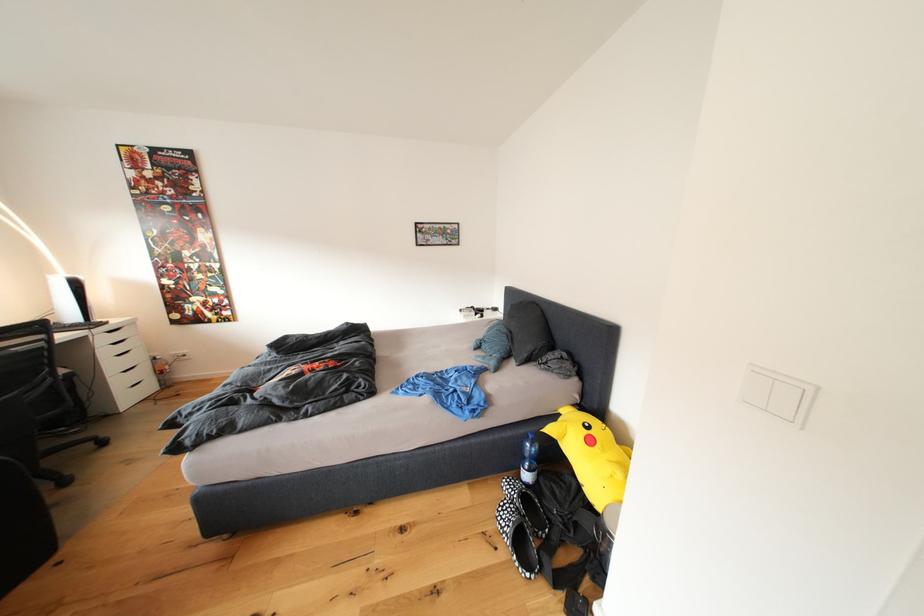
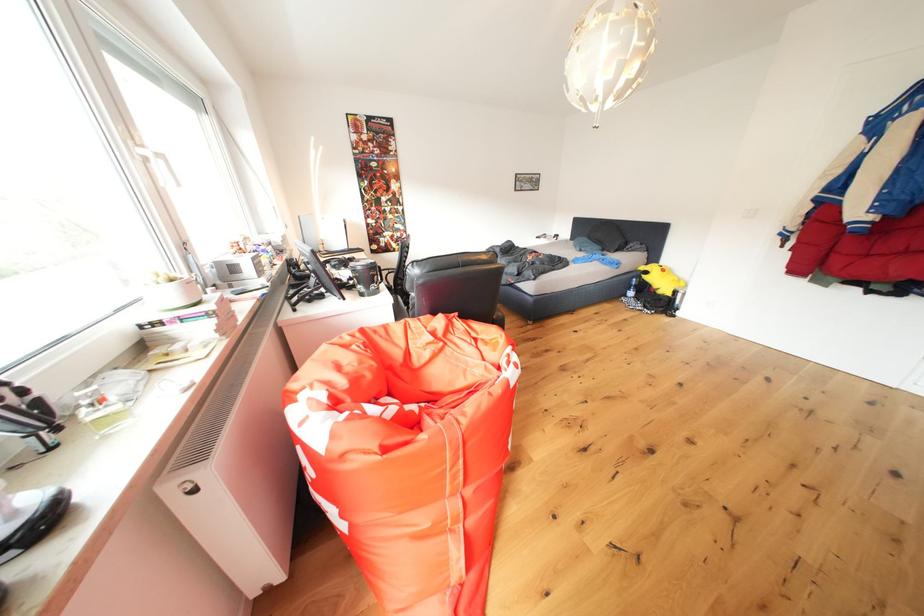
Question: I am providing you with two images of the same scene from different viewpoints. Please identify which objects are invisible in image2.

Choices:
 (A) green and yellow can
 (B) plastic water bottle
 (C) black travel mug
 (D) black chair armrest

Answer: (D)